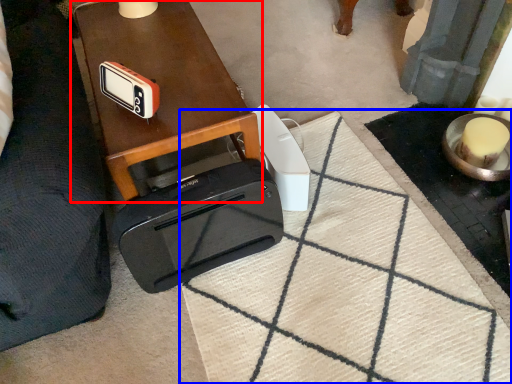
Question: Which object is closer to the camera taking this photo, table (highlighted by a red box) or doormat (highlighted by a blue box)?

Choices:
 (A) table
 (B) doormat

Answer: (B)